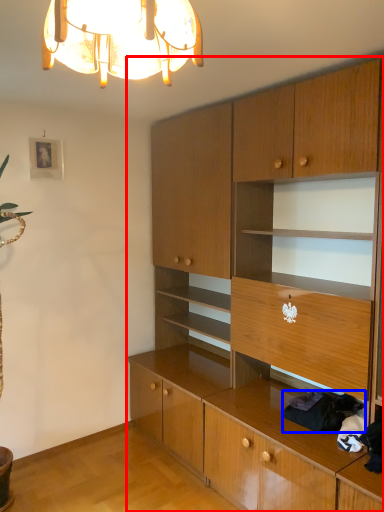
Question: Which point is closer to the camera, cabinetry (highlighted by a red box) or clothing (highlighted by a blue box)?

Choices:
 (A) cabinetry
 (B) clothing

Answer: (A)